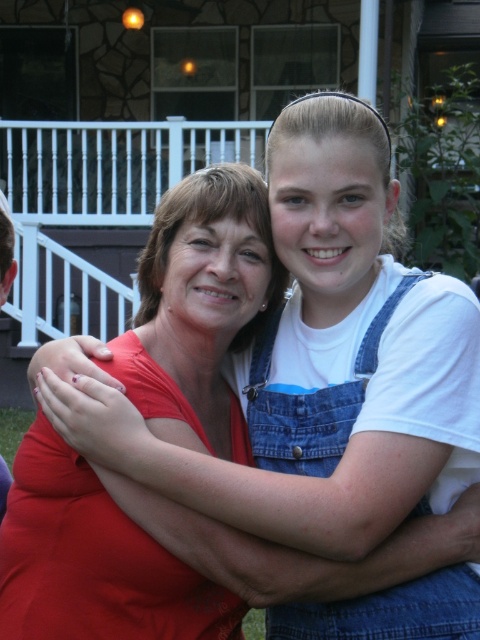
Question: Is denim overalls at center below denim overalls at right?

Choices:
 (A) yes
 (B) no

Answer: (A)

Question: Which of the following is the closest to the observer?

Choices:
 (A) denim overalls at right
 (B) matte red shirt at center

Answer: (B)

Question: Which point is farther to the camera?

Choices:
 (A) (11, 221)
 (B) (439, 570)
 (C) (0, 560)

Answer: (A)

Question: Can you confirm if matte red shirt at center is positioned to the right of denim overalls at center?

Choices:
 (A) yes
 (B) no

Answer: (B)

Question: Among these objects, which one is nearest to the camera?

Choices:
 (A) denim overalls at right
 (B) matte red shirt at center
 (C) denim overalls at center

Answer: (B)

Question: Does denim overalls at center have a larger size compared to denim overalls at right?

Choices:
 (A) yes
 (B) no

Answer: (A)